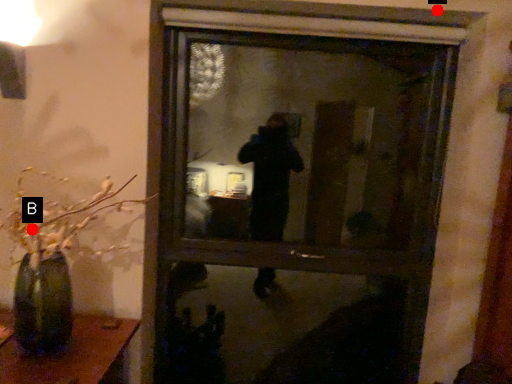
Question: Two points are circled on the image, labeled by A and B beside each circle. Which point appears farthest from the camera in this image?

Choices:
 (A) A is further
 (B) B is further

Answer: (A)